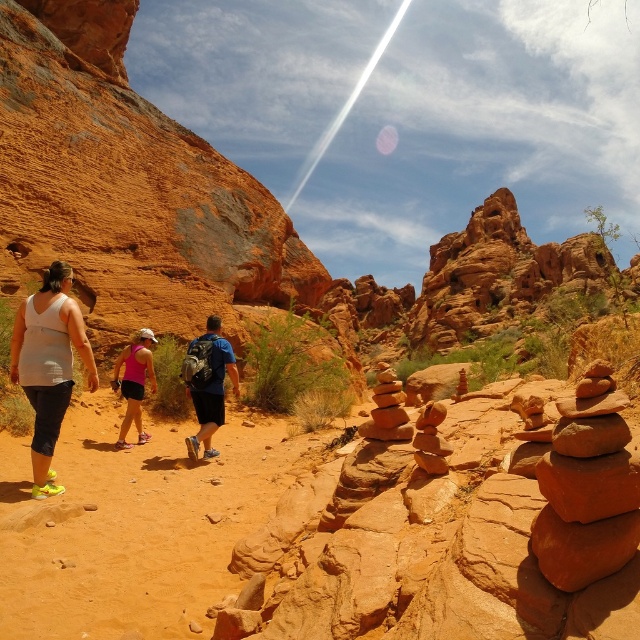
You are a hiker planning to place a water bottle between the white matte tank top at left and the blue fabric backpack at center. Given that the distance between them is 49.59 feet, can you estimate how far the water bottle should be placed from each object to be exactly halfway?

To place the water bottle exactly halfway between the white matte tank top at left and the blue fabric backpack at center, it should be placed 24.795 feet away from each object, as the total distance between them is 49.59 feet.

You are a photographer trying to capture a group photo of the hikers. You need to ensure that the white matte tank top at left and the blue fabric backpack at center are both clearly visible in the frame. Based on their sizes, which object might require more space in the composition?

The white matte tank top at left might be wider than the blue fabric backpack at center, so it might require more space in the composition to ensure it is fully visible.